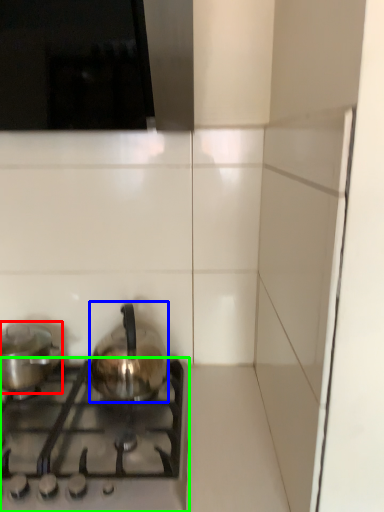
Question: Which object is the closest to the kitchen appliance (highlighted by a red box)? Choose among these: kitchen appliance (highlighted by a blue box) or gas stove (highlighted by a green box).

Choices:
 (A) kitchen appliance
 (B) gas stove

Answer: (A)